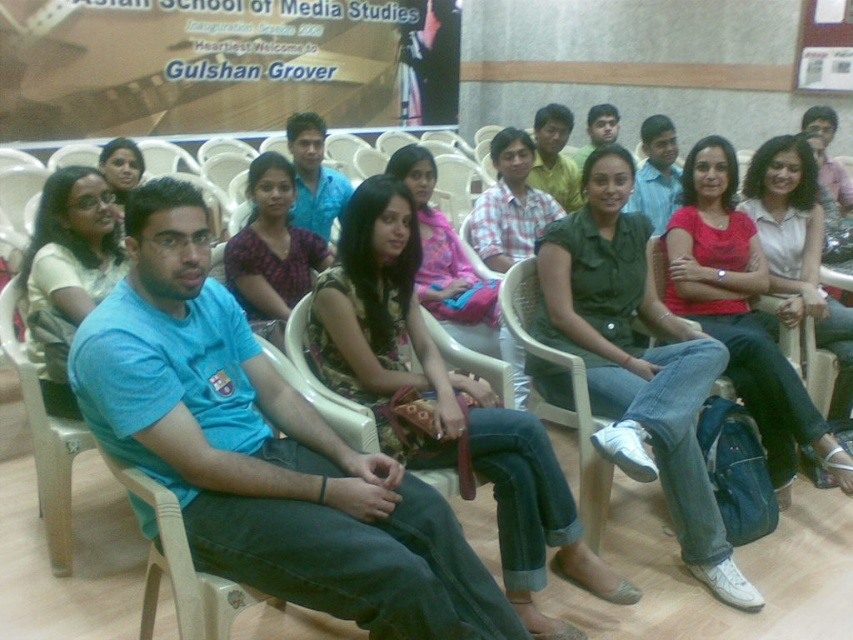
Who is shorter, green cotton shirt at center or blue t-shirt at left?

Standing shorter between the two is blue t-shirt at left.

Does green cotton shirt at center appear on the left side of blue t-shirt at left?

Incorrect, green cotton shirt at center is not on the left side of blue t-shirt at left.

I want to click on green cotton shirt at center, so click(636, 362).

Between blue cotton t-shirt at center and floral fabric dress at center, which one has less height?

blue cotton t-shirt at center

Does blue cotton t-shirt at center appear over floral fabric dress at center?

Incorrect, blue cotton t-shirt at center is not positioned above floral fabric dress at center.

Is point (135, 435) positioned in front of point (321, 300)?

Yes, it is in front of point (321, 300).

At what (x,y) coordinates should I click in order to perform the action: click on blue cotton t-shirt at center. Please return your answer as a coordinate pair (x, y). This screenshot has height=640, width=853. Looking at the image, I should click on (263, 451).

Does blue cotton t-shirt at center come in front of matte green shirt at center?

Yes, it is in front of matte green shirt at center.

Is point (212, 518) positioned after point (677, 193)?

That is False.

Where is `blue cotton t-shirt at center`? The height and width of the screenshot is (640, 853). blue cotton t-shirt at center is located at coordinates (263, 451).